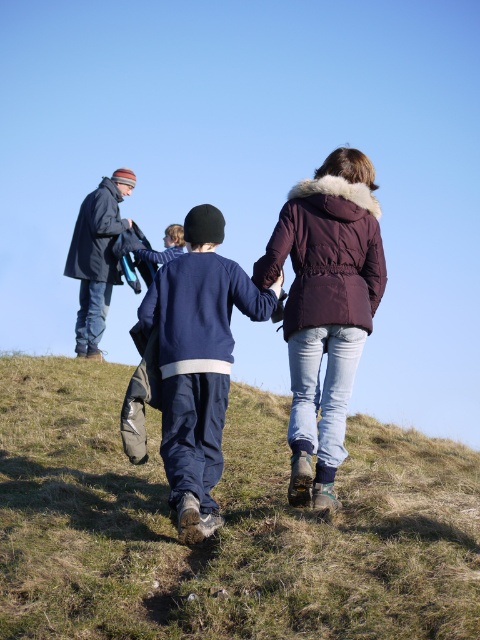
Question: Considering the real-world distances, which object is farthest from the navy blue fleece at center?

Choices:
 (A) green grassy at lower center
 (B) dark blue jacket at left
 (C) maroon synthetic jacket at center

Answer: (B)

Question: Does maroon synthetic jacket at center appear on the right side of navy blue fleece at center?

Choices:
 (A) no
 (B) yes

Answer: (B)

Question: Which object is farther from the camera taking this photo?

Choices:
 (A) maroon synthetic jacket at center
 (B) dark purple fleece jacket at center

Answer: (A)

Question: Is maroon synthetic jacket at center bigger than dark blue jacket at left?

Choices:
 (A) no
 (B) yes

Answer: (B)

Question: Which point is closer to the camera?

Choices:
 (A) navy blue fleece at center
 (B) dark purple fleece jacket at center

Answer: (A)

Question: Does green grassy at lower center have a smaller size compared to maroon synthetic jacket at center?

Choices:
 (A) no
 (B) yes

Answer: (B)